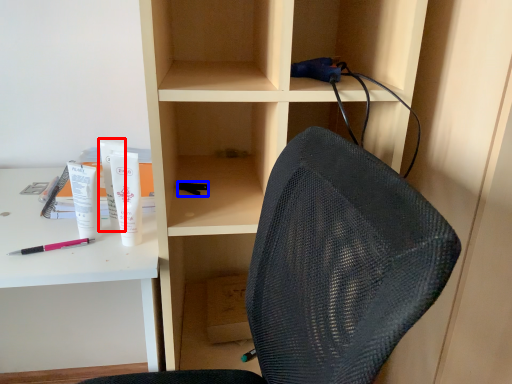
Question: Which object is closer to the camera taking this photo, stationery (highlighted by a red box) or stationery (highlighted by a blue box)?

Choices:
 (A) stationery
 (B) stationery

Answer: (A)